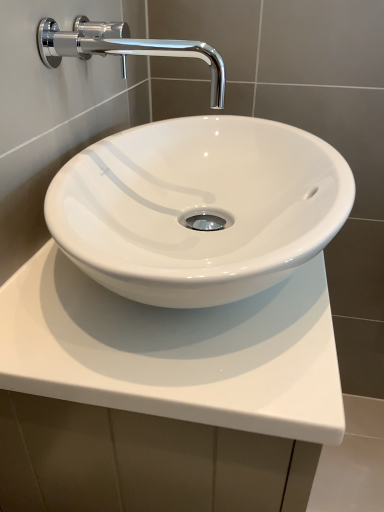
Question: Is white glossy countertop at center closer to camera compared to chrome/metallic faucet at upper left?

Choices:
 (A) no
 (B) yes

Answer: (B)

Question: Considering the relative sizes of white glossy countertop at center and chrome/metallic faucet at upper left in the image provided, is white glossy countertop at center shorter than chrome/metallic faucet at upper left?

Choices:
 (A) yes
 (B) no

Answer: (B)

Question: From a real-world perspective, is white glossy countertop at center positioned over chrome/metallic faucet at upper left based on gravity?

Choices:
 (A) yes
 (B) no

Answer: (B)

Question: From the image's perspective, is white glossy countertop at center on chrome/metallic faucet at upper left?

Choices:
 (A) no
 (B) yes

Answer: (A)

Question: Can chrome/metallic faucet at upper left be found inside white glossy countertop at center?

Choices:
 (A) yes
 (B) no

Answer: (B)

Question: Considering the relative sizes of white glossy countertop at center and chrome/metallic faucet at upper left in the image provided, is white glossy countertop at center thinner than chrome/metallic faucet at upper left?

Choices:
 (A) no
 (B) yes

Answer: (A)

Question: Can you confirm if chrome/metallic faucet at upper left is smaller than white glossy countertop at center?

Choices:
 (A) no
 (B) yes

Answer: (B)

Question: Is chrome/metallic faucet at upper left located outside white glossy countertop at center?

Choices:
 (A) no
 (B) yes

Answer: (B)

Question: Does chrome/metallic faucet at upper left have a greater height compared to white glossy countertop at center?

Choices:
 (A) yes
 (B) no

Answer: (B)

Question: Does chrome/metallic faucet at upper left turn towards white glossy countertop at center?

Choices:
 (A) no
 (B) yes

Answer: (A)

Question: Is chrome/metallic faucet at upper left in front of white glossy countertop at center?

Choices:
 (A) yes
 (B) no

Answer: (B)

Question: Considering the relative sizes of chrome/metallic faucet at upper left and white glossy countertop at center in the image provided, is chrome/metallic faucet at upper left thinner than white glossy countertop at center?

Choices:
 (A) yes
 (B) no

Answer: (A)

Question: Would you say chrome/metallic faucet at upper left is to the left or to the right of white glossy countertop at center in the picture?

Choices:
 (A) left
 (B) right

Answer: (A)